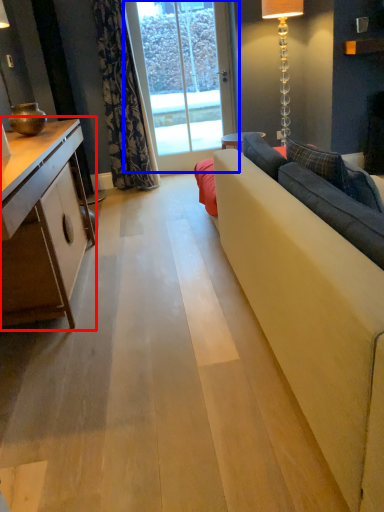
Question: Which object is closer to the camera taking this photo, cabinetry (highlighted by a red box) or window screen (highlighted by a blue box)?

Choices:
 (A) cabinetry
 (B) window screen

Answer: (A)